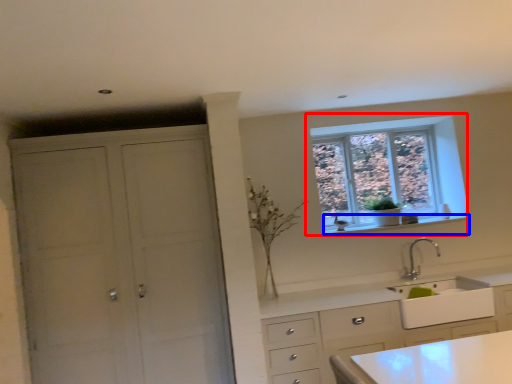
Question: Which of the following is the farthest to the observer, window (highlighted by a red box) or window sill (highlighted by a blue box)?

Choices:
 (A) window
 (B) window sill

Answer: (A)